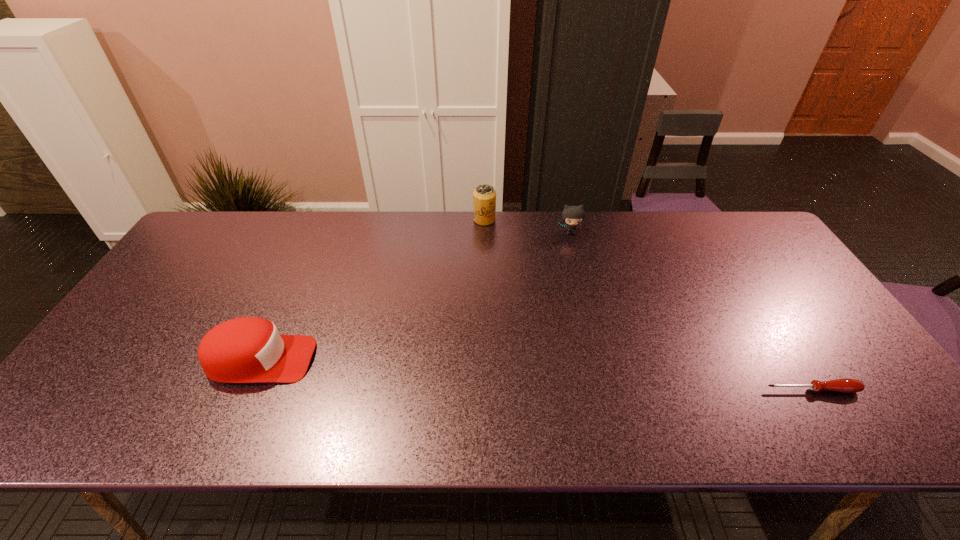
Identify the location of blank space at the far right corner. The width and height of the screenshot is (960, 540). (736, 237).

Locate an element on the screen. empty space that is in between the shortest object and the baseball cap is located at coordinates (536, 375).

At what (x,y) coordinates should I click in order to perform the action: click on free spot between the rightmost object and the third nearest object. Please return your answer as a coordinate pair (x, y). This screenshot has width=960, height=540. Looking at the image, I should click on (691, 311).

This screenshot has height=540, width=960. Identify the location of free space that is in between the tallest object and the third object from left to right. (527, 226).

The image size is (960, 540). In order to click on vacant area that lies between the shortest object and the third nearest object in this screenshot , I will do click(691, 311).

Locate an element on the screen. free space that is in between the leftmost object and the kitten is located at coordinates (416, 296).

Identify the location of empty location between the kitten and the farthest object. The width and height of the screenshot is (960, 540). (527, 226).

Identify the location of vacant space in between the second object from left to right and the baseball cap. This screenshot has height=540, width=960. (372, 289).

Find the location of `empty location between the rightmost object and the third nearest object`. empty location between the rightmost object and the third nearest object is located at coordinates (691, 311).

Find the location of `vacant region between the farthest object and the kitten`. vacant region between the farthest object and the kitten is located at coordinates (527, 226).